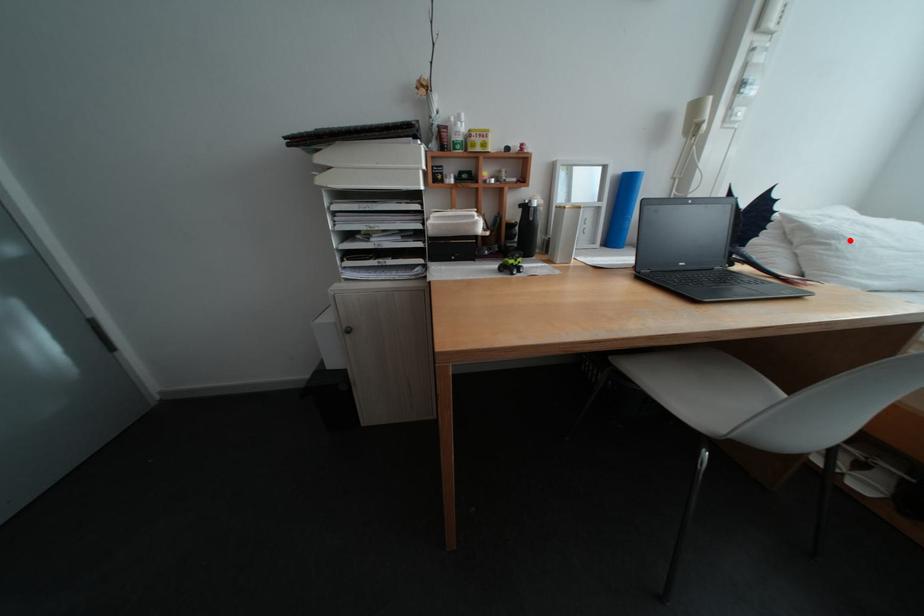
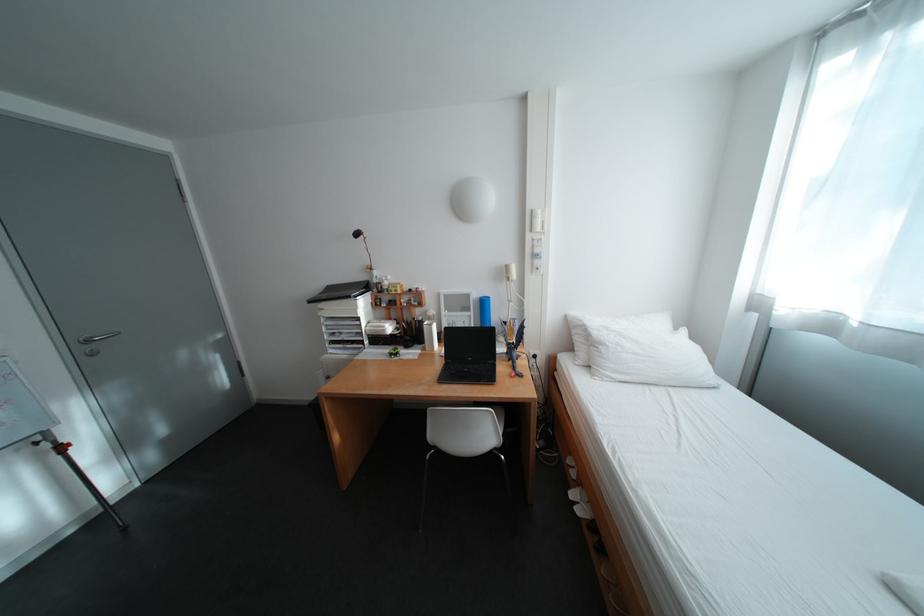
Locate, in the second image, the point that corresponds to the highlighted location in the first image.

(614, 346)